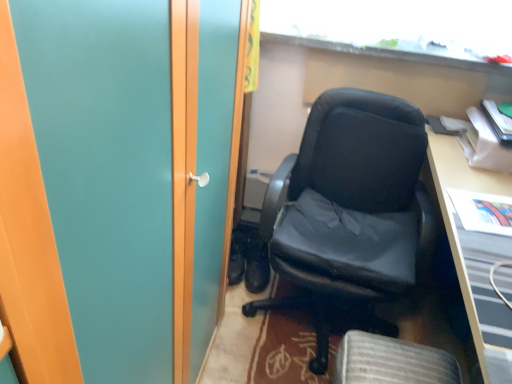
Question: In which direction should I rotate to look at black leather shoes at center, which ranks as the 1th footwear in left-to-right order?

Choices:
 (A) right
 (B) left

Answer: (B)

Question: Does black leather shoes at center, the 2th footwear when ordered from right to left, have a smaller size compared to transparent glass window at upper center?

Choices:
 (A) no
 (B) yes

Answer: (B)

Question: Does black leather shoes at center, which ranks as the 1th footwear in left-to-right order, have a greater width compared to transparent glass window at upper center?

Choices:
 (A) yes
 (B) no

Answer: (A)

Question: Considering the relative positions of black leather shoes at center, which ranks as the 1th footwear in left-to-right order, and transparent glass window at upper center in the image provided, is black leather shoes at center, which ranks as the 1th footwear in left-to-right order, in front of transparent glass window at upper center?

Choices:
 (A) yes
 (B) no

Answer: (B)

Question: From a real-world perspective, is black leather shoes at center, the 2th footwear when ordered from right to left, located higher than transparent glass window at upper center?

Choices:
 (A) no
 (B) yes

Answer: (A)

Question: Considering the relative sizes of black leather shoes at center, which ranks as the 1th footwear in left-to-right order, and transparent glass window at upper center in the image provided, is black leather shoes at center, which ranks as the 1th footwear in left-to-right order, thinner than transparent glass window at upper center?

Choices:
 (A) yes
 (B) no

Answer: (B)

Question: Is black leather shoes at center, which ranks as the 1th footwear in left-to-right order, shorter than transparent glass window at upper center?

Choices:
 (A) no
 (B) yes

Answer: (A)

Question: Is black leather shoes at center, which ranks as the second footwear in left-to-right order, turned away from transparent glass window at upper center?

Choices:
 (A) no
 (B) yes

Answer: (A)

Question: Could you tell me if black leather shoes at center, marked as the 1th footwear in a right-to-left arrangement, is facing transparent glass window at upper center?

Choices:
 (A) yes
 (B) no

Answer: (B)

Question: Is black leather shoes at center, marked as the 1th footwear in a right-to-left arrangement, with transparent glass window at upper center?

Choices:
 (A) yes
 (B) no

Answer: (B)

Question: Can you confirm if black leather shoes at center, which ranks as the second footwear in left-to-right order, is wider than transparent glass window at upper center?

Choices:
 (A) yes
 (B) no

Answer: (A)

Question: Does black leather shoes at center, marked as the 1th footwear in a right-to-left arrangement, have a larger size compared to transparent glass window at upper center?

Choices:
 (A) yes
 (B) no

Answer: (B)

Question: Is black leather shoes at center, which ranks as the second footwear in left-to-right order, further to camera compared to transparent glass window at upper center?

Choices:
 (A) no
 (B) yes

Answer: (B)

Question: Is black leather shoes at center, which ranks as the 1th footwear in left-to-right order, facing towards wooden desk at right?

Choices:
 (A) yes
 (B) no

Answer: (B)